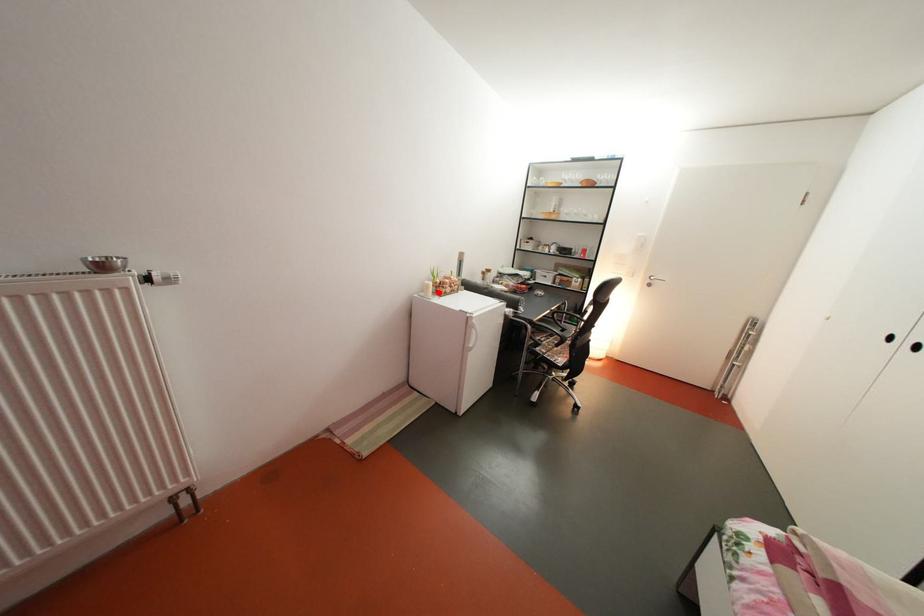
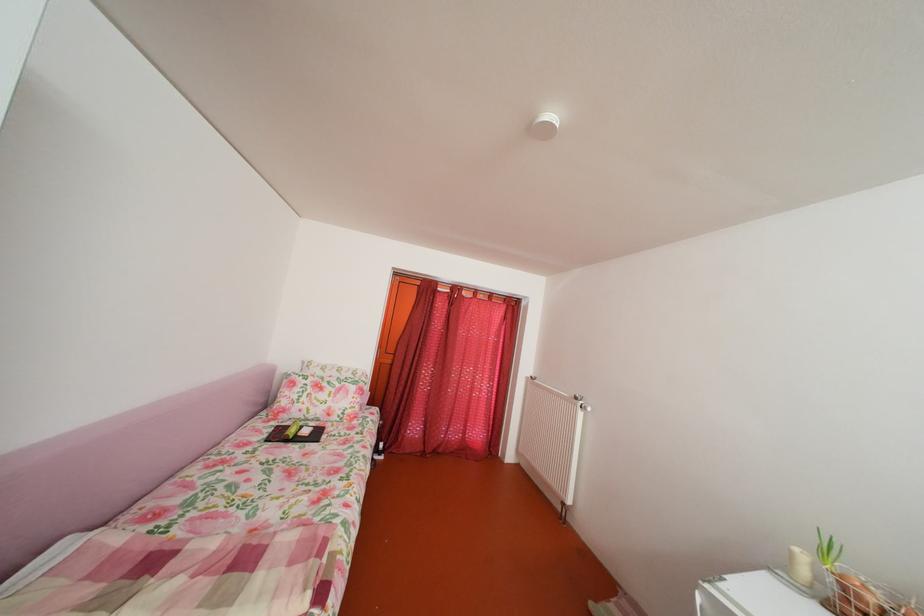
In the second image, find the point that corresponds to the highlighted location in the first image.

(803, 561)